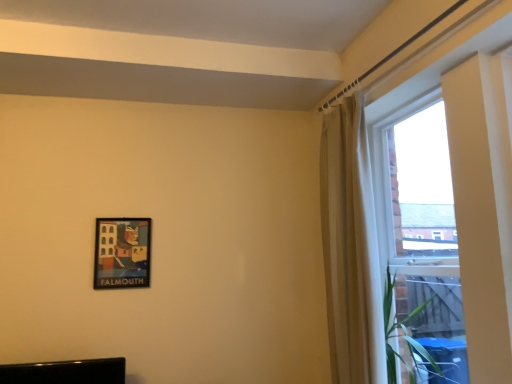
The image size is (512, 384). Describe the element at coordinates (351, 247) in the screenshot. I see `beige fabric curtain at upper right` at that location.

This screenshot has height=384, width=512. What do you see at coordinates (122, 253) in the screenshot? I see `matte black picture frame at lower left` at bounding box center [122, 253].

Describe the element at coordinates (447, 207) in the screenshot. This screenshot has width=512, height=384. I see `transparent glass window at right` at that location.

Where is `transparent glass window at right`? Image resolution: width=512 pixels, height=384 pixels. transparent glass window at right is located at coordinates (447, 207).

At what (x,y) coordinates should I click in order to perform the action: click on beige fabric curtain at upper right. Please return your answer as a coordinate pair (x, y). The width and height of the screenshot is (512, 384). Looking at the image, I should click on (351, 247).

Considering the relative positions of matte black picture frame at lower left and transparent glass window at right in the image provided, is matte black picture frame at lower left to the right of transparent glass window at right from the viewer's perspective?

Incorrect, matte black picture frame at lower left is not on the right side of transparent glass window at right.

Consider the image. Can you tell me how much matte black picture frame at lower left and transparent glass window at right differ in facing direction?

87.9 degrees.

Is matte black picture frame at lower left placed right next to transparent glass window at right?

No, matte black picture frame at lower left is not touching transparent glass window at right.

Could you tell me if matte black picture frame at lower left is turned towards transparent glass window at right?

No, matte black picture frame at lower left does not turn towards transparent glass window at right.

Which is less distant, (343,164) or (361,336)?

Positioned in front is point (361,336).

Is the surface of beige fabric curtain at upper right in direct contact with transparent glass window at right?

beige fabric curtain at upper right and transparent glass window at right are clearly separated.

Between beige fabric curtain at upper right and transparent glass window at right, which one appears on the right side from the viewer's perspective?

Positioned to the right is transparent glass window at right.

Where is `curtain lying behind the transparent glass window at right`? The image size is (512, 384). curtain lying behind the transparent glass window at right is located at coordinates pos(351,247).

Looking at their sizes, would you say beige fabric curtain at upper right is wider or thinner than matte black picture frame at lower left?

Considering their sizes, beige fabric curtain at upper right looks broader than matte black picture frame at lower left.

From the image's perspective, between beige fabric curtain at upper right and matte black picture frame at lower left, which one is located above?

beige fabric curtain at upper right appears higher in the image.

Consider the image. Is beige fabric curtain at upper right bigger or smaller than matte black picture frame at lower left?

beige fabric curtain at upper right is bigger than matte black picture frame at lower left.

Would you say matte black picture frame at lower left is inside or outside beige fabric curtain at upper right?

matte black picture frame at lower left exists outside the volume of beige fabric curtain at upper right.

Can you confirm if matte black picture frame at lower left is taller than beige fabric curtain at upper right?

In fact, matte black picture frame at lower left may be shorter than beige fabric curtain at upper right.

Is matte black picture frame at lower left closer to camera compared to beige fabric curtain at upper right?

No.

Is transparent glass window at right turned away from matte black picture frame at lower left?

No, transparent glass window at right is not facing away from matte black picture frame at lower left.

Does transparent glass window at right contain matte black picture frame at lower left?

No, matte black picture frame at lower left is not surrounded by transparent glass window at right.

Considering the sizes of objects transparent glass window at right and matte black picture frame at lower left in the image provided, who is wider, transparent glass window at right or matte black picture frame at lower left?

transparent glass window at right is wider.

Does point (358, 110) appear closer or farther from the camera than point (124, 255)?

Point (358, 110) appears to be closer to the viewer than point (124, 255).

Where is `window in front of the beige fabric curtain at upper right`? Image resolution: width=512 pixels, height=384 pixels. window in front of the beige fabric curtain at upper right is located at coordinates (447, 207).

Looking at this image, is transparent glass window at right thinner than beige fabric curtain at upper right?

No.

Is the depth of transparent glass window at right greater than that of beige fabric curtain at upper right?

That is False.

Would you consider transparent glass window at right to be distant from beige fabric curtain at upper right?

That's not correct — transparent glass window at right is a little close to beige fabric curtain at upper right.

Where is `window that appears above the matte black picture frame at lower left (from a real-world perspective)`? The width and height of the screenshot is (512, 384). window that appears above the matte black picture frame at lower left (from a real-world perspective) is located at coordinates (447, 207).

Find the location of a particular element. window beneath the beige fabric curtain at upper right (from a real-world perspective) is located at coordinates (447, 207).

When comparing their distances from matte black picture frame at lower left, does beige fabric curtain at upper right or transparent glass window at right seem closer?

beige fabric curtain at upper right lies closer to matte black picture frame at lower left than the other object.

Estimate the real-world distances between objects in this image. Which object is closer to transparent glass window at right, beige fabric curtain at upper right or matte black picture frame at lower left?

beige fabric curtain at upper right is closer to transparent glass window at right.

Considering their positions, is matte black picture frame at lower left positioned closer to transparent glass window at right than beige fabric curtain at upper right?

Based on the image, beige fabric curtain at upper right appears to be nearer to transparent glass window at right.

Estimate the real-world distances between objects in this image. Which object is closer to beige fabric curtain at upper right, transparent glass window at right or matte black picture frame at lower left?

transparent glass window at right is closer to beige fabric curtain at upper right.

Considering their positions, is matte black picture frame at lower left positioned closer to beige fabric curtain at upper right than transparent glass window at right?

Among the two, transparent glass window at right is located nearer to beige fabric curtain at upper right.

Looking at the image, which one is located further to matte black picture frame at lower left, transparent glass window at right or beige fabric curtain at upper right?

Among the two, transparent glass window at right is located further to matte black picture frame at lower left.

In order to click on curtain located between matte black picture frame at lower left and transparent glass window at right in the left-right direction in this screenshot , I will do `click(351, 247)`.